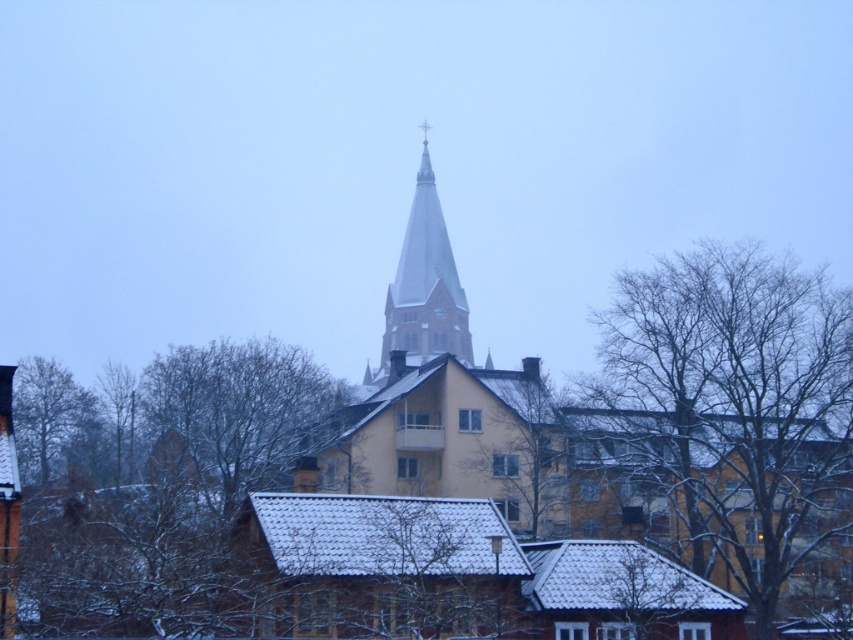
You are an architect designing a new garden layout. You need to place a statue between the bare branches at upper center and the green leafy tree at lower left. Based on their heights, which object should the statue be closer to?

The statue should be closer to the bare branches at upper center because it has a greater height compared to the green leafy tree at lower left.

You are an artist sketching this winter scene. You want to draw the bare branches at upper center and the smooth gray steeple at center accurately. Which object should you sketch first to ensure proper layering?

Result: The bare branches at upper center should be sketched first because they are in front of the smooth gray steeple at center, so they need to be layered on top.

You are standing in the winter scene and see two points in the image. The first point is at coordinates point (750, 486) and the second is at point (424, 326). Which point is nearer to you?

Point (750, 486) is closer to the viewer than point (424, 326).